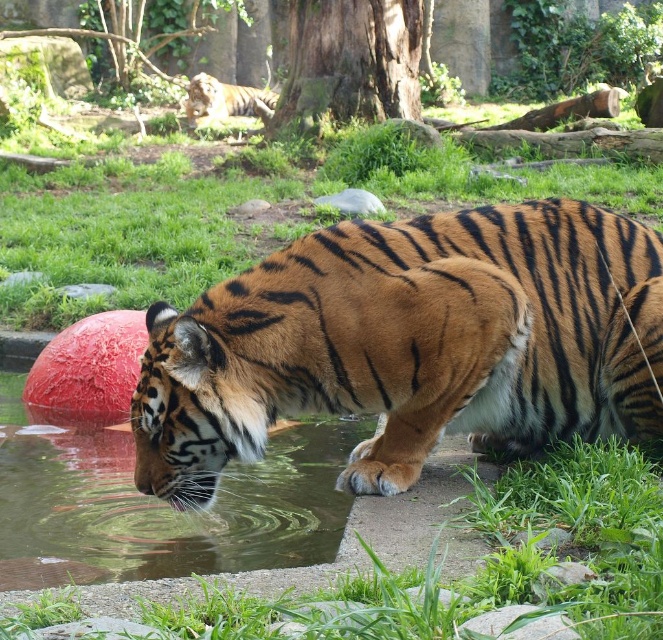
Does point (105, 552) lie in front of point (186, 102)?

Yes.

Who is more forward, [310,506] or [215,83]?

Point [310,506] is in front.

In order to click on clear water at lower left in this screenshot , I will do `click(156, 502)`.

Is orange fur tiger at center bigger than clear water at lower left?

No.

Is orange fur tiger at center taller than clear water at lower left?

Correct, orange fur tiger at center is much taller as clear water at lower left.

Locate an element on the screen. This screenshot has width=663, height=640. orange fur tiger at center is located at coordinates (410, 344).

This screenshot has width=663, height=640. I want to click on orange fur tiger at center, so click(410, 344).

Who is more forward, (215,394) or (247,97)?

Point (215,394) is in front.

What do you see at coordinates (410, 344) in the screenshot? I see `orange fur tiger at center` at bounding box center [410, 344].

Does point (585, 342) lie in front of point (210, 108)?

Yes, point (585, 342) is closer to viewer.

Identify the location of orange fur tiger at center. (410, 344).